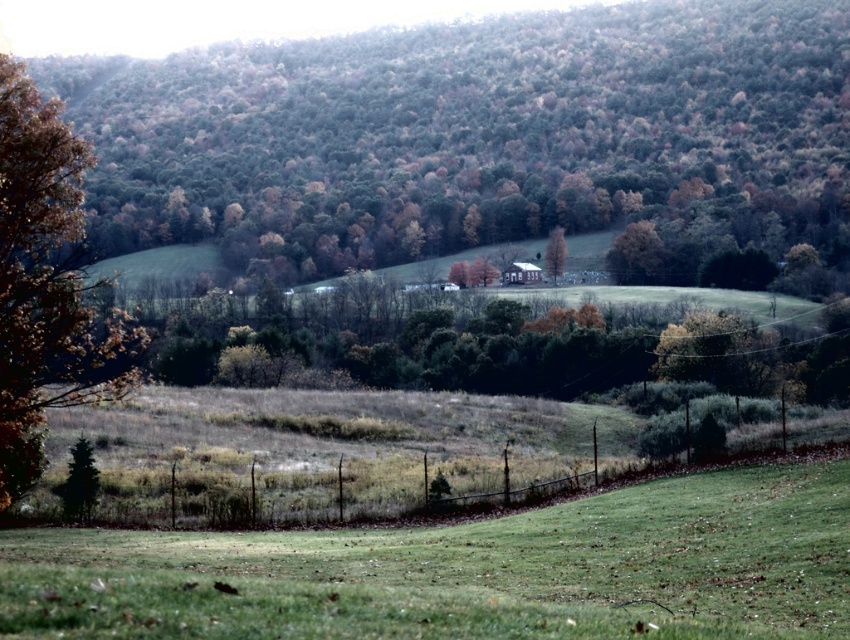
Is point (41, 163) in front of point (561, 257)?

Yes, it is.

Does point (88, 356) come closer to viewer compared to point (551, 275)?

Yes, it is.

What are the coordinates of `brown textured tree at left` in the screenshot? It's located at (47, 284).

Who is lower down, green grassy field at lower center or brown matte tree at center?

green grassy field at lower center

Is green grassy field at lower center smaller than brown matte tree at center?

No, green grassy field at lower center is not smaller than brown matte tree at center.

Looking at this image, who is more distant from viewer, (x=649, y=595) or (x=561, y=248)?

The point (x=561, y=248) is more distant.

This screenshot has width=850, height=640. Find the location of `green grassy field at lower center`. green grassy field at lower center is located at coordinates (468, 570).

Which of these two, brown leafy tree at center or brown textured tree at left, stands taller?

brown leafy tree at center is taller.

Who is lower down, brown leafy tree at center or brown textured tree at left?

Positioned lower is brown textured tree at left.

Which is in front, point (783, 74) or point (44, 305)?

Positioned in front is point (44, 305).

The height and width of the screenshot is (640, 850). I want to click on brown leafy tree at center, so click(x=479, y=138).